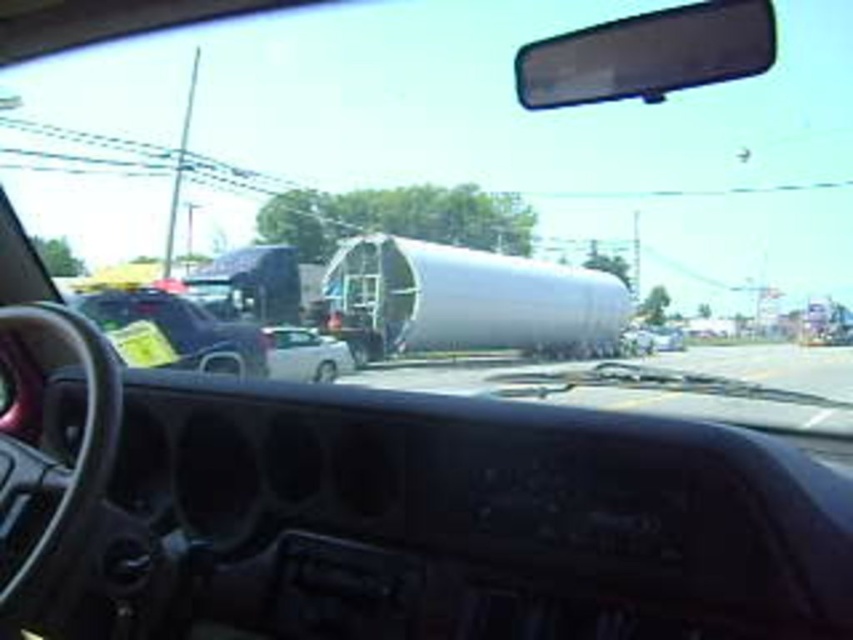
Who is positioned more to the left, transparent plastic view mirror at upper center or white glossy car at center?

From the viewer's perspective, white glossy car at center appears more on the left side.

Does transparent plastic view mirror at upper center have a greater width compared to white glossy car at center?

Incorrect, transparent plastic view mirror at upper center's width does not surpass white glossy car at center's.

Which is in front, point (645, 36) or point (273, 326)?

Positioned in front is point (645, 36).

This screenshot has width=853, height=640. I want to click on transparent plastic view mirror at upper center, so click(x=647, y=54).

Between transparent plastic view mirror at upper center and matte black car at left, which one has more height?

matte black car at left is taller.

Does transparent plastic view mirror at upper center have a larger size compared to matte black car at left?

Actually, transparent plastic view mirror at upper center might be smaller than matte black car at left.

Which is in front, point (624, 44) or point (171, 312)?

Point (624, 44) is more forward.

Locate an element on the screen. transparent plastic view mirror at upper center is located at coordinates (647, 54).

Is matte black car at left bigger than white glossy car at center?

Actually, matte black car at left might be smaller than white glossy car at center.

Who is lower down, matte black car at left or white glossy car at center?

white glossy car at center is below.

Between point (196, 307) and point (289, 346), which one is positioned in front?

Point (196, 307) is in front.

Locate an element on the screen. matte black car at left is located at coordinates (173, 332).